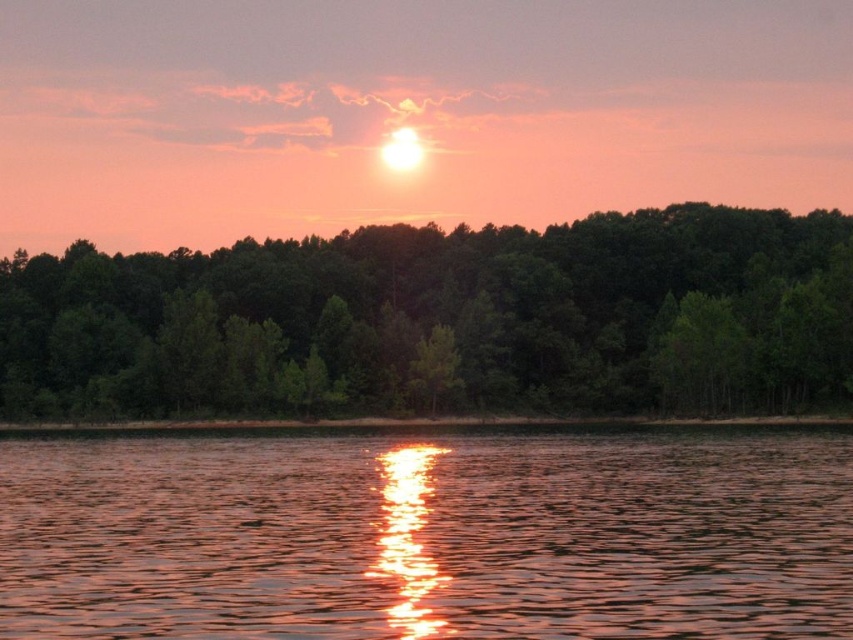
In the scene shown: You are standing at the edge of the water in the sunset scene. There are two points marked on the image. The first point is at coordinates point (196, 496) and the second point is at point (457, 400). Which point is closer to you?

Point (196, 496) is in front of point (457, 400), so it is closer to you.

You are an artist painting the sunset scene. You need to decide where to place the sun reflection. Based on the positions of the glistening water at center and green matte trees at center, which object should the sun reflection be closer to?

The sun reflection should be closer to the glistening water at center because it occupies less space than the green matte trees at center, making it a better focal point for the reflection.